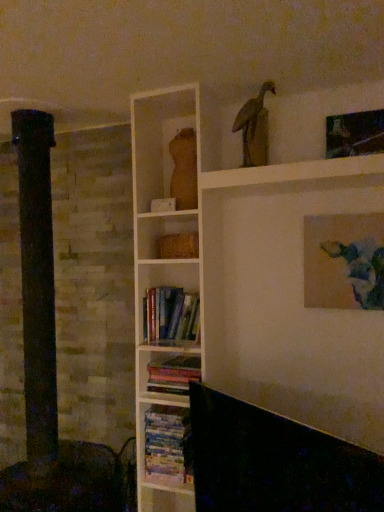
This screenshot has height=512, width=384. What do you see at coordinates (168, 445) in the screenshot? I see `hardcover books at center, the 1th book ordered from the bottom` at bounding box center [168, 445].

Locate an element on the screen. The width and height of the screenshot is (384, 512). wooden statue at upper center is located at coordinates (253, 126).

Describe the element at coordinates (355, 134) in the screenshot. Image resolution: width=384 pixels, height=512 pixels. I see `metallic silver picture frame at upper right, which ranks as the first picture frame in top-to-bottom order` at that location.

I want to click on hardcover books at center, marked as the third book in a bottom-to-top arrangement, so click(170, 315).

What do you see at coordinates (174, 374) in the screenshot? This screenshot has height=512, width=384. I see `hardcover books at center, the second book when ordered from top to bottom` at bounding box center [174, 374].

Measure the distance between matte canvas painting at upper right, which ranks as the first picture frame in bottom-to-top order, and camera.

The distance of matte canvas painting at upper right, which ranks as the first picture frame in bottom-to-top order, from camera is 1.78 meters.

I want to click on hardcover books at center, which ranks as the 3th book in top-to-bottom order, so click(168, 445).

Between hardcover books at center, the 1th book ordered from the bottom, and wooden statue at upper center, which one has larger width?

hardcover books at center, the 1th book ordered from the bottom, is wider.

Is hardcover books at center, the 1th book ordered from the bottom, taller or shorter than wooden statue at upper center?

In the image, hardcover books at center, the 1th book ordered from the bottom, appears to be shorter than wooden statue at upper center.

Between hardcover books at center, which ranks as the 3th book in top-to-bottom order, and wooden statue at upper center, which one appears on the right side from the viewer's perspective?

Positioned to the right is wooden statue at upper center.

Is hardcover books at center, which ranks as the 3th book in top-to-bottom order, bigger or smaller than wooden statue at upper center?

In the image, hardcover books at center, which ranks as the 3th book in top-to-bottom order, appears to be larger than wooden statue at upper center.

Consider the image. Can you confirm if wooden statue at upper center is smaller than matte canvas painting at upper right, which ranks as the second picture frame in top-to-bottom order?

Yes.

Find the location of `the 1st picture frame counting from the right side of the wooden statue at upper center`. the 1st picture frame counting from the right side of the wooden statue at upper center is located at coordinates (344, 261).

Is wooden statue at upper center in contact with matte canvas painting at upper right, which ranks as the first picture frame in bottom-to-top order?

No, wooden statue at upper center is not touching matte canvas painting at upper right, which ranks as the first picture frame in bottom-to-top order.

From a real-world perspective, who is located higher, wooden statue at upper center or matte canvas painting at upper right, which ranks as the first picture frame in bottom-to-top order?

wooden statue at upper center is physically above.

From the image's perspective, is hardcover books at center, the second book when ordered from top to bottom, above matte wooden torso at upper center?

No.

You are a GUI agent. You are given a task and a screenshot of the screen. Output one action in this format:
    pyautogui.click(x=<x>, y=<y>)
    Task: Click on the animal on the right of hardcover books at center, positioned as the second book in bottom-to-top order
    
    Given the screenshot: What is the action you would take?
    pyautogui.click(x=184, y=169)

From a real-world perspective, between hardcover books at center, positioned as the second book in bottom-to-top order, and matte wooden torso at upper center, who is vertically higher?

matte wooden torso at upper center, from a real-world perspective.

Can you confirm if hardcover books at center, positioned as the second book in bottom-to-top order, is wider than matte wooden torso at upper center?

Correct, the width of hardcover books at center, positioned as the second book in bottom-to-top order, exceeds that of matte wooden torso at upper center.

Considering the sizes of objects matte canvas painting at upper right, which ranks as the first picture frame in bottom-to-top order, and wooden statue at upper center in the image provided, who is shorter, matte canvas painting at upper right, which ranks as the first picture frame in bottom-to-top order, or wooden statue at upper center?

With less height is wooden statue at upper center.

Can you confirm if matte canvas painting at upper right, which ranks as the second picture frame in top-to-bottom order, is positioned to the right of wooden statue at upper center?

Yes.

Is matte canvas painting at upper right, which ranks as the second picture frame in top-to-bottom order, directly adjacent to wooden statue at upper center?

There is a gap between matte canvas painting at upper right, which ranks as the second picture frame in top-to-bottom order, and wooden statue at upper center.

From the image's perspective, is matte canvas painting at upper right, which ranks as the second picture frame in top-to-bottom order, above or below wooden statue at upper center?

From the image's perspective, matte canvas painting at upper right, which ranks as the second picture frame in top-to-bottom order, appears below wooden statue at upper center.

What's the angular difference between hardcover books at center, which ranks as the 3th book in top-to-bottom order, and hardcover books at center, marked as the first book in a top-to-bottom arrangement,'s facing directions?

The angular difference between hardcover books at center, which ranks as the 3th book in top-to-bottom order, and hardcover books at center, marked as the first book in a top-to-bottom arrangement, is 0.939 degrees.

Is hardcover books at center, marked as the third book in a bottom-to-top arrangement, located within hardcover books at center, the 1th book ordered from the bottom?

That's incorrect, hardcover books at center, marked as the third book in a bottom-to-top arrangement, is not inside hardcover books at center, the 1th book ordered from the bottom.

Which object is more forward, hardcover books at center, which ranks as the 3th book in top-to-bottom order, or hardcover books at center, marked as the first book in a top-to-bottom arrangement?

hardcover books at center, marked as the first book in a top-to-bottom arrangement.

How much distance is there between hardcover books at center, the 1th book ordered from the bottom, and hardcover books at center, marked as the first book in a top-to-bottom arrangement?

hardcover books at center, the 1th book ordered from the bottom, and hardcover books at center, marked as the first book in a top-to-bottom arrangement, are 16.99 inches apart.

Is wooden statue at upper center with hardcover books at center, the second book when ordered from top to bottom?

wooden statue at upper center is not next to hardcover books at center, the second book when ordered from top to bottom, and they're not touching.

From the image's perspective, which is below, wooden statue at upper center or hardcover books at center, positioned as the second book in bottom-to-top order?

hardcover books at center, positioned as the second book in bottom-to-top order, appears lower in the image.

Between point (263, 136) and point (152, 378), which one is positioned behind?

The point (263, 136) is farther.

Considering the sizes of objects metallic silver picture frame at upper right, which ranks as the first picture frame in top-to-bottom order, and matte wooden torso at upper center in the image provided, who is shorter, metallic silver picture frame at upper right, which ranks as the first picture frame in top-to-bottom order, or matte wooden torso at upper center?

metallic silver picture frame at upper right, which ranks as the first picture frame in top-to-bottom order, is shorter.

Is metallic silver picture frame at upper right, which ranks as the first picture frame in top-to-bottom order, far away from matte wooden torso at upper center?

They are positioned close to each other.

The width and height of the screenshot is (384, 512). Identify the location of animal below the metallic silver picture frame at upper right, positioned as the second picture frame in bottom-to-top order (from a real-world perspective). (184, 169).

The image size is (384, 512). Find the location of `book that is the 3rd one when counting downward from the wooden statue at upper center (from the image's perspective)`. book that is the 3rd one when counting downward from the wooden statue at upper center (from the image's perspective) is located at coordinates (168, 445).

From the wooden statue at upper center, count 1st picture frame to the right and point to it. Please provide its 2D coordinates.

[(344, 261)]

Which object lies nearer to the anchor point matte wooden torso at upper center, hardcover books at center, which ranks as the 3th book in top-to-bottom order, or matte canvas painting at upper right, which ranks as the second picture frame in top-to-bottom order?

Based on the image, matte canvas painting at upper right, which ranks as the second picture frame in top-to-bottom order, appears to be nearer to matte wooden torso at upper center.

Based on the photo, which object lies further to the anchor point hardcover books at center, marked as the first book in a top-to-bottom arrangement, metallic silver picture frame at upper right, which ranks as the first picture frame in top-to-bottom order, or hardcover books at center, the 1th book ordered from the bottom?

Based on the image, metallic silver picture frame at upper right, which ranks as the first picture frame in top-to-bottom order, appears to be further to hardcover books at center, marked as the first book in a top-to-bottom arrangement.

In the scene shown: Estimate the real-world distances between objects in this image. Which object is closer to hardcover books at center, positioned as the second book in bottom-to-top order, wooden statue at upper center or matte canvas painting at upper right, which ranks as the first picture frame in bottom-to-top order?

Based on the image, matte canvas painting at upper right, which ranks as the first picture frame in bottom-to-top order, appears to be nearer to hardcover books at center, positioned as the second book in bottom-to-top order.

Which object lies nearer to the anchor point matte canvas painting at upper right, which ranks as the first picture frame in bottom-to-top order, hardcover books at center, which ranks as the 3th book in top-to-bottom order, or hardcover books at center, the second book when ordered from top to bottom?

Based on the image, hardcover books at center, the second book when ordered from top to bottom, appears to be nearer to matte canvas painting at upper right, which ranks as the first picture frame in bottom-to-top order.

Considering their positions, is wooden statue at upper center positioned further to hardcover books at center, the second book when ordered from top to bottom, than hardcover books at center, the 1th book ordered from the bottom?

wooden statue at upper center lies further to hardcover books at center, the second book when ordered from top to bottom, than the other object.

Looking at the image, which one is located further to wooden statue at upper center, matte wooden torso at upper center or hardcover books at center, which ranks as the 3th book in top-to-bottom order?

hardcover books at center, which ranks as the 3th book in top-to-bottom order, lies further to wooden statue at upper center than the other object.

Which object lies nearer to the anchor point matte canvas painting at upper right, which ranks as the second picture frame in top-to-bottom order, hardcover books at center, marked as the first book in a top-to-bottom arrangement, or metallic silver picture frame at upper right, which ranks as the first picture frame in top-to-bottom order?

metallic silver picture frame at upper right, which ranks as the first picture frame in top-to-bottom order, is closer to matte canvas painting at upper right, which ranks as the second picture frame in top-to-bottom order.

Looking at the image, which one is located closer to wooden statue at upper center, matte canvas painting at upper right, which ranks as the first picture frame in bottom-to-top order, or hardcover books at center, positioned as the second book in bottom-to-top order?

Among the two, matte canvas painting at upper right, which ranks as the first picture frame in bottom-to-top order, is located nearer to wooden statue at upper center.

You are a GUI agent. You are given a task and a screenshot of the screen. Output one action in this format:
    pyautogui.click(x=<x>, y=<y>)
    Task: Click on the picture frame between matte wooden torso at upper center and hardcover books at center, which ranks as the 3th book in top-to-bottom order, vertically
    The width and height of the screenshot is (384, 512).
    Given the screenshot: What is the action you would take?
    pyautogui.click(x=344, y=261)

Image resolution: width=384 pixels, height=512 pixels. I want to click on picture frame between hardcover books at center, marked as the third book in a bottom-to-top arrangement, and metallic silver picture frame at upper right, positioned as the second picture frame in bottom-to-top order, from left to right, so click(x=344, y=261).

What are the coordinates of `bird between matte wooden torso at upper center and metallic silver picture frame at upper right, which ranks as the first picture frame in top-to-bottom order, from left to right` in the screenshot? It's located at (253, 126).

Find the location of a particular element. animal situated between hardcover books at center, marked as the third book in a bottom-to-top arrangement, and matte canvas painting at upper right, which ranks as the second picture frame in top-to-bottom order, from left to right is located at coordinates (184, 169).